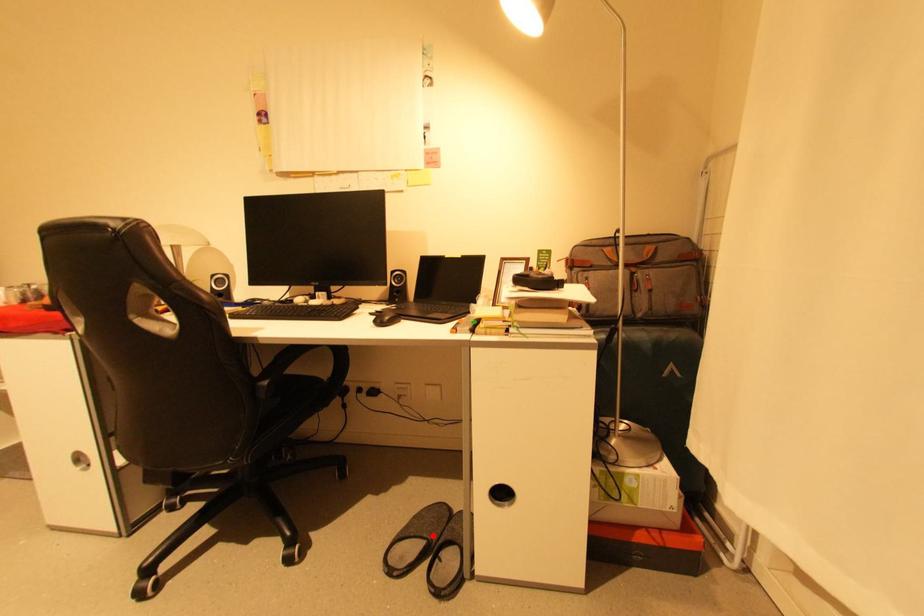
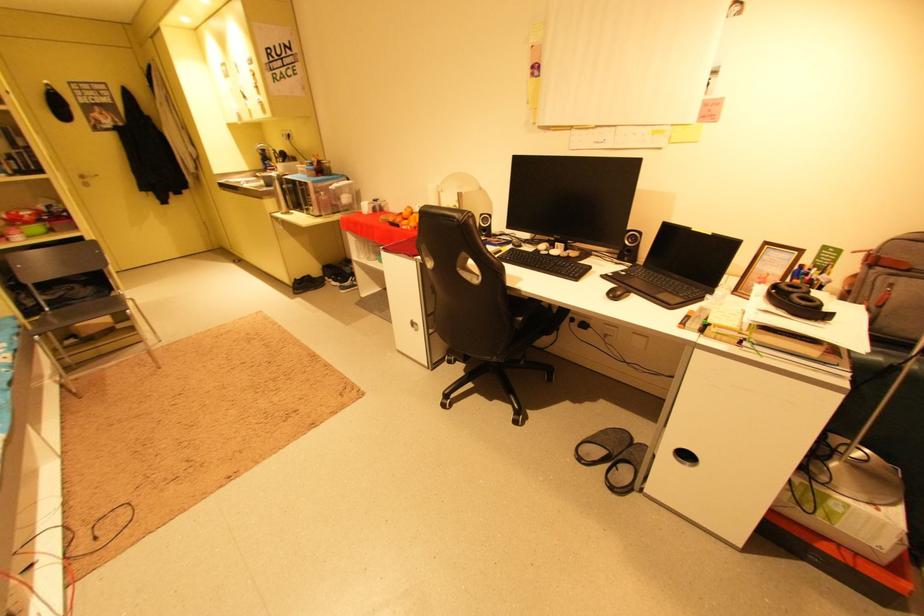
In the second image, find the point that corresponds to the highlighted location in the first image.

(616, 448)